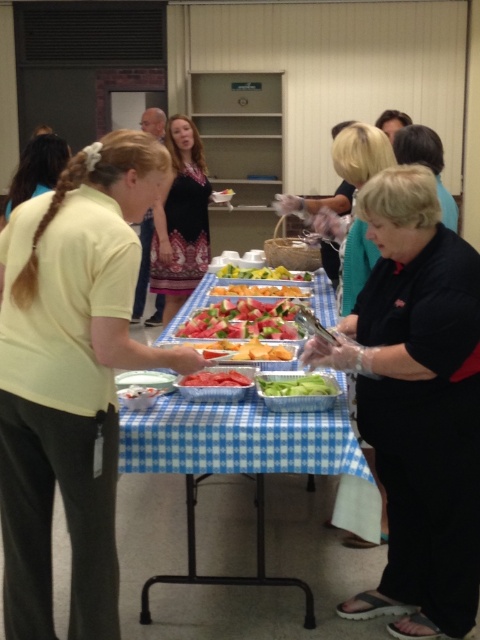
You are at a buffet table and want to grab both the green matte celery at center and the red matte watermelon at center. Which one should you reach for first if you want to grab the one closer to your left side?

The red matte watermelon at center is closer to your left side since the green matte celery at center is positioned to its right.

You are at a buffet table and want to grab both the green matte celery at center and the red matte watermelon at center. If your plate can only hold items within 6 inches of each other, will they fit together on the plate?

The distance between the green matte celery at center and the red matte watermelon at center is 6.63 inches. Since this exceeds the 6 inches limit, they won